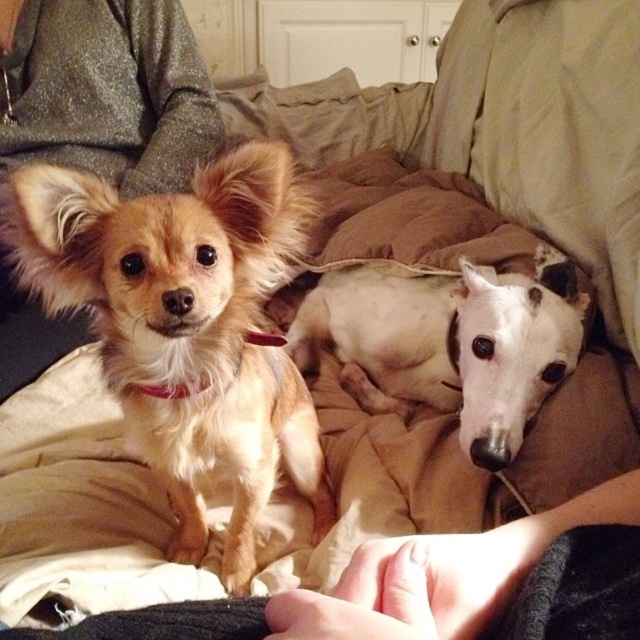
Is white smooth dog at center wider than smooth skin hand at lower center?

Yes, white smooth dog at center is wider than smooth skin hand at lower center.

Is white smooth dog at center bigger than smooth skin hand at lower center?

Indeed, white smooth dog at center has a larger size compared to smooth skin hand at lower center.

Between point (300, 323) and point (348, 630), which one is positioned behind?

The point (300, 323) is behind.

Locate an element on the screen. Image resolution: width=640 pixels, height=640 pixels. white smooth dog at center is located at coordinates (451, 342).

Does fuzzy brown dog at left appear under smooth skin hand at lower center?

Incorrect, fuzzy brown dog at left is not positioned below smooth skin hand at lower center.

Is fuzzy brown dog at left above smooth skin hand at lower center?

Yes, fuzzy brown dog at left is above smooth skin hand at lower center.

Does point (292, 436) come behind point (388, 572)?

Yes, it is behind point (388, 572).

Image resolution: width=640 pixels, height=640 pixels. I want to click on fuzzy brown dog at left, so click(186, 326).

Who is positioned more to the right, fuzzy brown dog at left or white smooth dog at center?

Positioned to the right is white smooth dog at center.

Does fuzzy brown dog at left have a lesser width compared to white smooth dog at center?

Yes.

You are a GUI agent. You are given a task and a screenshot of the screen. Output one action in this format:
    pyautogui.click(x=<x>, y=<y>)
    Task: Click on the fuzzy brown dog at left
    
    Given the screenshot: What is the action you would take?
    pyautogui.click(x=186, y=326)

Identify the location of fuzzy brown dog at left. The image size is (640, 640). (186, 326).